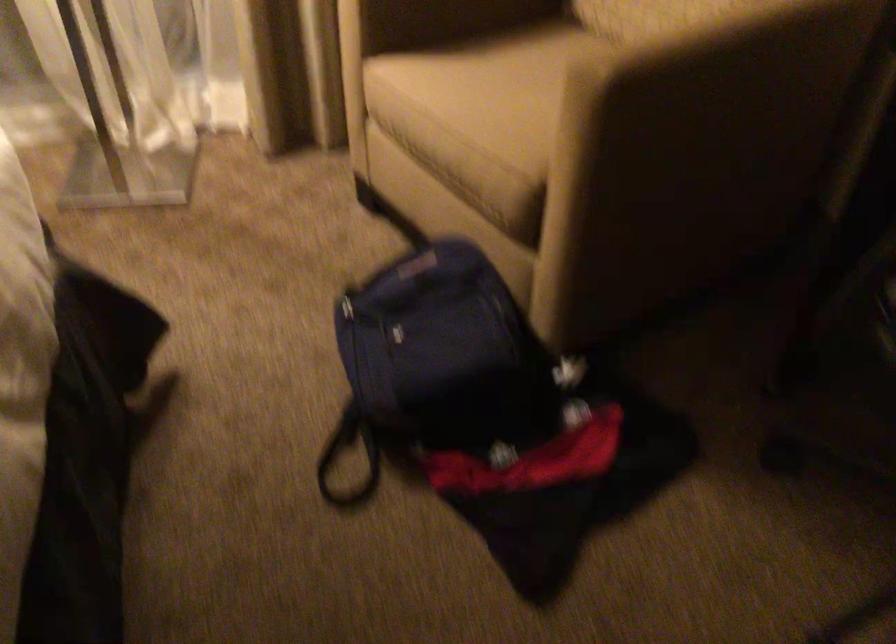
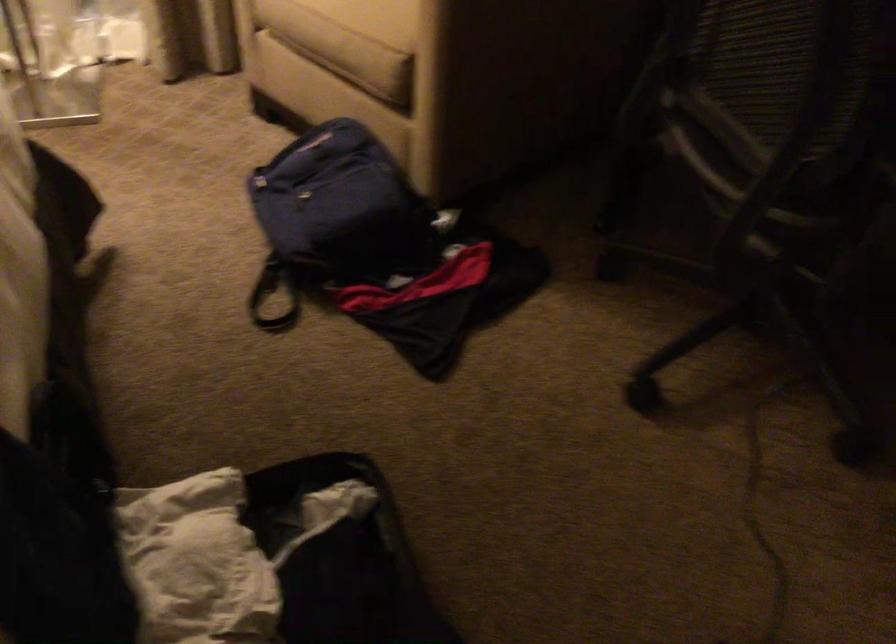
Question: Based on the continuous images, in which direction is the camera rotating? Reply with the corresponding letter.

Choices:
 (A) Left
 (B) Right
 (C) Up
 (D) Down

Answer: (B)